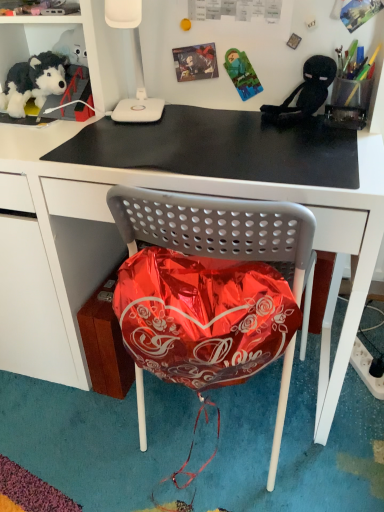
Question: Can you confirm if black plush toy at upper right is smaller than white plastic lamp at upper center?

Choices:
 (A) yes
 (B) no

Answer: (A)

Question: Is black plush toy at upper right positioned before white plastic lamp at upper center?

Choices:
 (A) no
 (B) yes

Answer: (A)

Question: From a real-world perspective, is black plush toy at upper right positioned under white plastic lamp at upper center based on gravity?

Choices:
 (A) yes
 (B) no

Answer: (A)

Question: Is white plastic lamp at upper center surrounded by black plush toy at upper right?

Choices:
 (A) yes
 (B) no

Answer: (B)

Question: Could you tell me if black plush toy at upper right is facing white plastic lamp at upper center?

Choices:
 (A) yes
 (B) no

Answer: (B)

Question: Considering the relative sizes of black plush toy at upper right and white plastic lamp at upper center in the image provided, is black plush toy at upper right thinner than white plastic lamp at upper center?

Choices:
 (A) yes
 (B) no

Answer: (A)

Question: Is black plush toy at upper right closer to the viewer compared to white plastic power outlet at lower right?

Choices:
 (A) yes
 (B) no

Answer: (A)

Question: Is black plush toy at upper right oriented towards white plastic power outlet at lower right?

Choices:
 (A) yes
 (B) no

Answer: (B)

Question: Are black plush toy at upper right and white plastic power outlet at lower right located far from each other?

Choices:
 (A) yes
 (B) no

Answer: (B)

Question: Is black plush toy at upper right thinner than white plastic power outlet at lower right?

Choices:
 (A) no
 (B) yes

Answer: (B)

Question: Would you say black plush toy at upper right is outside white plastic power outlet at lower right?

Choices:
 (A) no
 (B) yes

Answer: (B)

Question: Is white plastic power outlet at lower right at the back of black plush toy at upper right?

Choices:
 (A) yes
 (B) no

Answer: (B)

Question: Does white plastic lamp at upper center have a lesser width compared to soft plush toy at upper left?

Choices:
 (A) yes
 (B) no

Answer: (B)